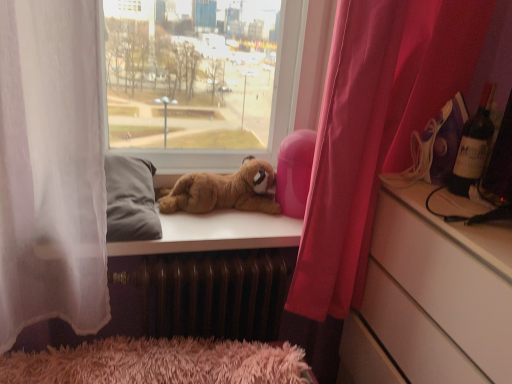
Question: Is dark red glass wine bottle at upper right outside of soft brown plush dog at center?

Choices:
 (A) no
 (B) yes

Answer: (B)

Question: From the image's perspective, is dark red glass wine bottle at upper right above soft brown plush dog at center?

Choices:
 (A) yes
 (B) no

Answer: (A)

Question: Are dark red glass wine bottle at upper right and soft brown plush dog at center located far from each other?

Choices:
 (A) yes
 (B) no

Answer: (B)

Question: Does dark red glass wine bottle at upper right come in front of soft brown plush dog at center?

Choices:
 (A) yes
 (B) no

Answer: (A)

Question: Does dark red glass wine bottle at upper right appear on the left side of soft brown plush dog at center?

Choices:
 (A) yes
 (B) no

Answer: (B)

Question: Considering the relative sizes of dark red glass wine bottle at upper right and soft brown plush dog at center in the image provided, is dark red glass wine bottle at upper right taller than soft brown plush dog at center?

Choices:
 (A) yes
 (B) no

Answer: (A)

Question: Does brown metallic radiator at lower center have a lesser width compared to dark red glass wine bottle at upper right?

Choices:
 (A) yes
 (B) no

Answer: (B)

Question: Does brown metallic radiator at lower center touch dark red glass wine bottle at upper right?

Choices:
 (A) no
 (B) yes

Answer: (A)

Question: From a real-world perspective, is brown metallic radiator at lower center located higher than dark red glass wine bottle at upper right?

Choices:
 (A) yes
 (B) no

Answer: (B)

Question: Can you confirm if brown metallic radiator at lower center is smaller than dark red glass wine bottle at upper right?

Choices:
 (A) yes
 (B) no

Answer: (B)

Question: Is brown metallic radiator at lower center far from dark red glass wine bottle at upper right?

Choices:
 (A) yes
 (B) no

Answer: (B)

Question: From the image's perspective, would you say brown metallic radiator at lower center is positioned over dark red glass wine bottle at upper right?

Choices:
 (A) yes
 (B) no

Answer: (B)

Question: From the image's perspective, is pink fabric curtain at right below brown metallic radiator at lower center?

Choices:
 (A) yes
 (B) no

Answer: (B)